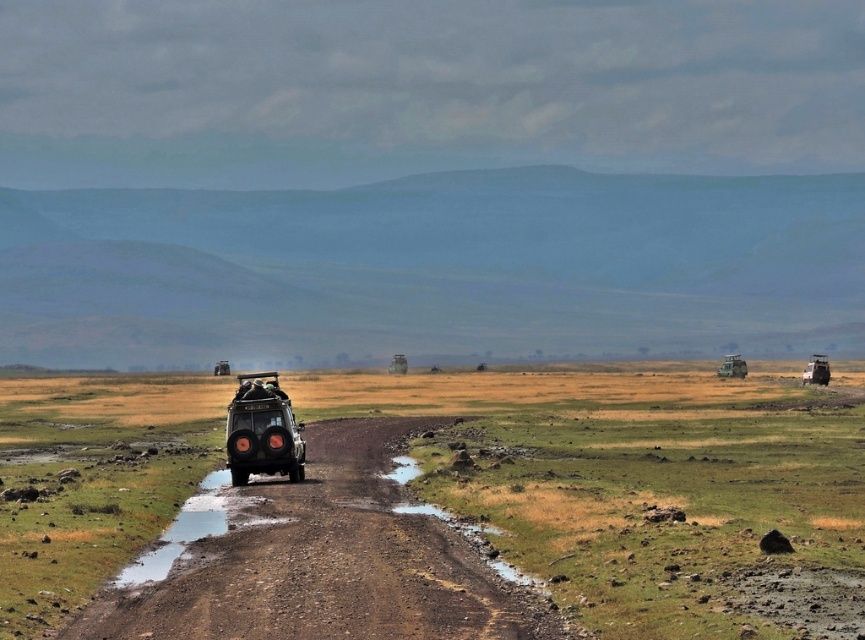
Question: Estimate the real-world distances between objects in this image. Which object is closer to the matte green truck at center-right?

Choices:
 (A) green grassland at center
 (B) brown dirt track at center

Answer: (A)

Question: Is the position of green grassland at center more distant than that of matte black jeep at center?

Choices:
 (A) no
 (B) yes

Answer: (A)

Question: Does green grassland at center appear on the right side of matte black jeep at right?

Choices:
 (A) no
 (B) yes

Answer: (A)

Question: Does matte black jeep at center have a greater width compared to matte black jeep at right?

Choices:
 (A) yes
 (B) no

Answer: (B)

Question: Among these points, which one is farthest from the camera?

Choices:
 (A) (729, 376)
 (B) (254, 472)

Answer: (A)

Question: Among these points, which one is farthest from the camera?

Choices:
 (A) (171, 595)
 (B) (274, 372)

Answer: (B)